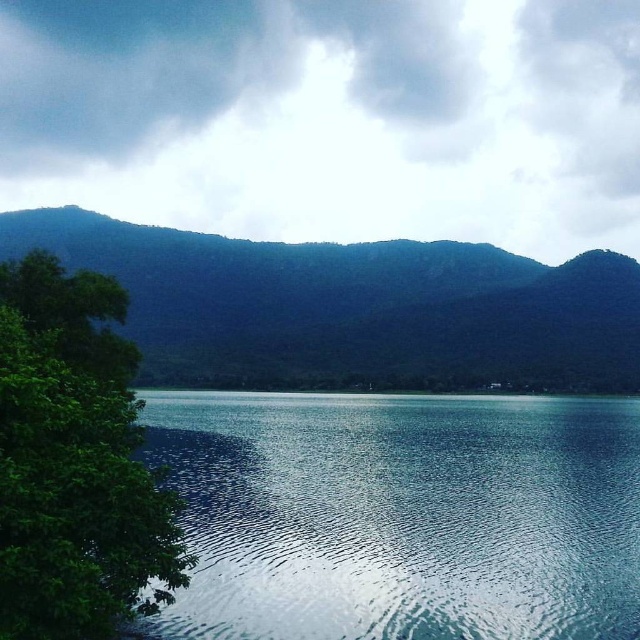
Consider the image. You are standing at the edge of the lake in the scene. There is a white fluffy cloud at upper center marked by point (x=330, y=116). If you want to look at the cloud, where should you direct your gaze?

You should direct your gaze to the upper center where the white fluffy cloud is marked by point (x=330, y=116).

You are standing at the edge of the lake and see the white fluffy cloud at upper center and the green leafy tree at left. Which object is farther from you?

The white fluffy cloud at upper center is farther from you than the green leafy tree at left since it is 693.21 meters away from the tree, implying the cloud is further away.